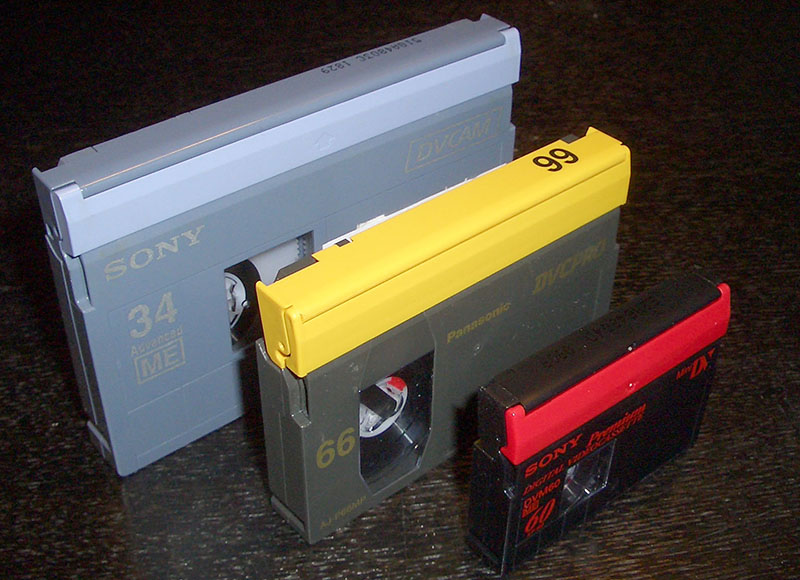
Find the location of `short grain lines in wood table`. short grain lines in wood table is located at coordinates (677, 528), (708, 520), (632, 556), (584, 561).